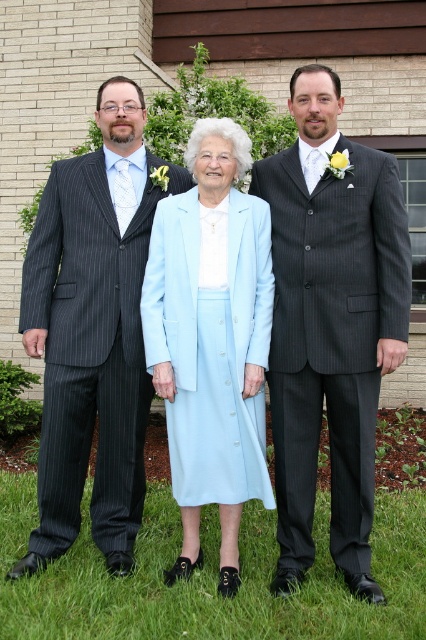
This screenshot has width=426, height=640. Find the location of `light blue fabric dress at center`. light blue fabric dress at center is located at coordinates point(212,340).

Is point (222, 573) less distant than point (253, 502)?

Yes, it is in front of point (253, 502).

You are a GUI agent. You are given a task and a screenshot of the screen. Output one action in this format:
    pyautogui.click(x=<x>, y=<y>)
    Task: Click on the light blue fabric dress at center
    
    Given the screenshot: What is the action you would take?
    pyautogui.click(x=212, y=340)

Can you confirm if striped pinstripe suit at left is shorter than green grass at lower center?

Incorrect, striped pinstripe suit at left's height does not fall short of green grass at lower center's.

Is striped pinstripe suit at left in front of green grass at lower center?

No.

What do you see at coordinates (92, 332) in the screenshot?
I see `striped pinstripe suit at left` at bounding box center [92, 332].

Locate an element on the screen. This screenshot has width=426, height=640. striped pinstripe suit at left is located at coordinates (92, 332).

Who is positioned more to the left, dark gray pinstripe suit at center or striped pinstripe suit at left?

From the viewer's perspective, striped pinstripe suit at left appears more on the left side.

Can you confirm if dark gray pinstripe suit at center is positioned above striped pinstripe suit at left?

Actually, dark gray pinstripe suit at center is below striped pinstripe suit at left.

Describe the element at coordinates (331, 324) in the screenshot. The height and width of the screenshot is (640, 426). I see `dark gray pinstripe suit at center` at that location.

Locate an element on the screen. dark gray pinstripe suit at center is located at coordinates (331, 324).